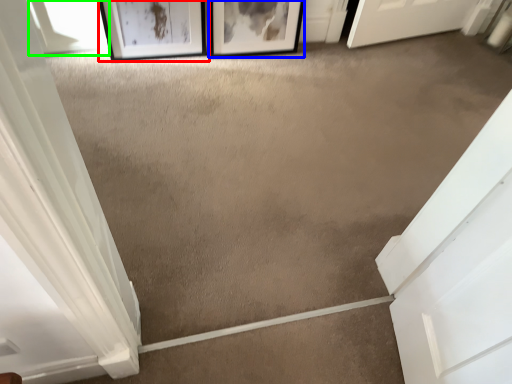
Question: Which object is positioned closest to picture frame (highlighted by a red box)? Select from picture frame (highlighted by a blue box) and window (highlighted by a green box).

Choices:
 (A) picture frame
 (B) window

Answer: (B)